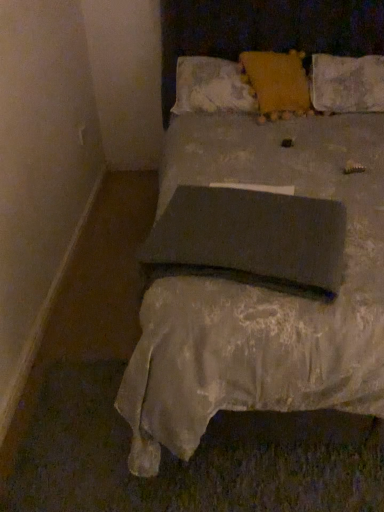
Question: Which direction should I rotate to face fluffy white pillow at upper center, the 4th pillow viewed from the front, — up or down?

Choices:
 (A) down
 (B) up

Answer: (B)

Question: From the image's perspective, would you say fluffy white pillow at upper center, the 4th pillow viewed from the front, is shown under dark gray fabric pillow at center, placed as the fourth pillow when sorted from back to front?

Choices:
 (A) yes
 (B) no

Answer: (B)

Question: Does fluffy white pillow at upper center, the 4th pillow viewed from the front, come in front of dark gray fabric pillow at center, placed as the fourth pillow when sorted from back to front?

Choices:
 (A) yes
 (B) no

Answer: (B)

Question: Considering the relative sizes of fluffy white pillow at upper center, the 4th pillow viewed from the front, and dark gray fabric pillow at center, placed as the fourth pillow when sorted from back to front, in the image provided, is fluffy white pillow at upper center, the 4th pillow viewed from the front, taller than dark gray fabric pillow at center, placed as the fourth pillow when sorted from back to front,?

Choices:
 (A) yes
 (B) no

Answer: (A)

Question: From a real-world perspective, is fluffy white pillow at upper center, the first pillow viewed from the back, on dark gray fabric pillow at center, placed as the fourth pillow when sorted from back to front?

Choices:
 (A) no
 (B) yes

Answer: (B)

Question: Does fluffy white pillow at upper center, the first pillow viewed from the back, have a greater width compared to dark gray fabric pillow at center, the 1th pillow from the front?

Choices:
 (A) yes
 (B) no

Answer: (B)

Question: Can you confirm if fluffy white pillow at upper center, the 4th pillow viewed from the front, is positioned to the left of dark gray fabric pillow at center, placed as the fourth pillow when sorted from back to front?

Choices:
 (A) no
 (B) yes

Answer: (A)

Question: Is fluffy white pillow at upper center, the first pillow viewed from the back, positioned behind matte gray bed at center?

Choices:
 (A) yes
 (B) no

Answer: (A)

Question: Does fluffy white pillow at upper center, the 4th pillow viewed from the front, have a lesser height compared to matte gray bed at center?

Choices:
 (A) no
 (B) yes

Answer: (B)

Question: From a real-world perspective, is fluffy white pillow at upper center, the 4th pillow viewed from the front, located higher than matte gray bed at center?

Choices:
 (A) no
 (B) yes

Answer: (B)

Question: Is fluffy white pillow at upper center, the first pillow viewed from the back, located outside matte gray bed at center?

Choices:
 (A) no
 (B) yes

Answer: (A)

Question: From the image's perspective, is fluffy white pillow at upper center, the first pillow viewed from the back, under matte gray bed at center?

Choices:
 (A) no
 (B) yes

Answer: (A)

Question: Is fluffy white pillow at upper center, the first pillow viewed from the back, to the right of matte gray bed at center from the viewer's perspective?

Choices:
 (A) no
 (B) yes

Answer: (A)

Question: Could you tell me if dark gray fabric pillow at center, the 1th pillow from the front, is facing matte gray bed at center?

Choices:
 (A) no
 (B) yes

Answer: (B)